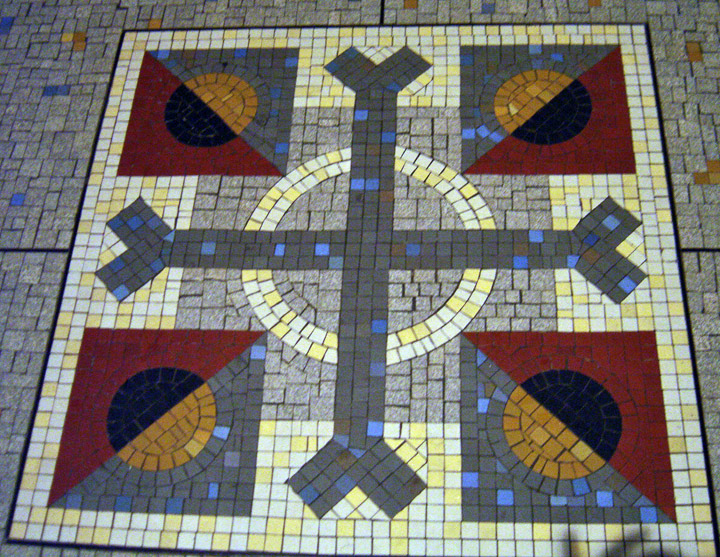
At what (x,y) coordinates should I click in order to perform the action: click on multi colored square mosaic. Please return your answer as a coordinate pair (x, y). The width and height of the screenshot is (720, 557). Looking at the image, I should click on (562, 421).